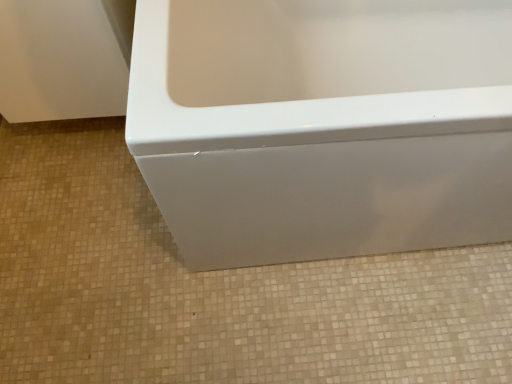
The width and height of the screenshot is (512, 384). What do you see at coordinates (215, 289) in the screenshot?
I see `white glossy bathtub at lower center` at bounding box center [215, 289].

Locate an element on the screen. The width and height of the screenshot is (512, 384). white glossy bathtub at lower center is located at coordinates (215, 289).

What is the approximate width of white glossy bathtub at center?

The width of white glossy bathtub at center is 29.92 inches.

This screenshot has height=384, width=512. Describe the element at coordinates (323, 126) in the screenshot. I see `white glossy bathtub at center` at that location.

The image size is (512, 384). Identify the location of white glossy bathtub at center. (323, 126).

At what (x,y) coordinates should I click in order to perform the action: click on white glossy bathtub at lower center. Please return your answer as a coordinate pair (x, y). The height and width of the screenshot is (384, 512). Looking at the image, I should click on (215, 289).

Considering the relative positions of white glossy bathtub at lower center and white glossy bathtub at center in the image provided, is white glossy bathtub at lower center to the right of white glossy bathtub at center from the viewer's perspective?

In fact, white glossy bathtub at lower center is to the left of white glossy bathtub at center.

Considering the relative positions of white glossy bathtub at lower center and white glossy bathtub at center in the image provided, is white glossy bathtub at lower center in front of white glossy bathtub at center?

That is False.

Between point (373, 352) and point (354, 130), which one is positioned in front?

Positioned in front is point (354, 130).

From the image's perspective, does white glossy bathtub at lower center appear higher than white glossy bathtub at center?

No, from the image's perspective, white glossy bathtub at lower center is not over white glossy bathtub at center.

From a real-world perspective, is white glossy bathtub at lower center physically located above or below white glossy bathtub at center?

white glossy bathtub at lower center is situated lower than white glossy bathtub at center in the real world.

Between white glossy bathtub at lower center and white glossy bathtub at center, which one has larger width?

white glossy bathtub at lower center.

Which of these two, white glossy bathtub at lower center or white glossy bathtub at center, stands shorter?

white glossy bathtub at lower center.

From the picture: Can you confirm if white glossy bathtub at lower center is bigger than white glossy bathtub at center?

Incorrect, white glossy bathtub at lower center is not larger than white glossy bathtub at center.

Is white glossy bathtub at lower center inside the boundaries of white glossy bathtub at center, or outside?

white glossy bathtub at lower center is located beyond the bounds of white glossy bathtub at center.

Is white glossy bathtub at lower center not near white glossy bathtub at center?

That's not correct — white glossy bathtub at lower center is a little close to white glossy bathtub at center.

Is white glossy bathtub at lower center turned away from white glossy bathtub at center?

white glossy bathtub at lower center is not turned away from white glossy bathtub at center.

Locate an element on the screen. ceramic tile on the left of white glossy bathtub at center is located at coordinates (215, 289).

Is white glossy bathtub at center to the left of white glossy bathtub at lower center from the viewer's perspective?

No, white glossy bathtub at center is not to the left of white glossy bathtub at lower center.

Which object is closer to the camera, white glossy bathtub at center or white glossy bathtub at lower center?

white glossy bathtub at center.

Which is further, (337, 71) or (365, 360)?

The point (337, 71) is behind.

Consider the image. From the image's perspective, between white glossy bathtub at center and white glossy bathtub at lower center, who is located below?

white glossy bathtub at lower center.

Consider the image. From a real-world perspective, does white glossy bathtub at center sit lower than white glossy bathtub at lower center?

Incorrect, from a real-world perspective, white glossy bathtub at center is higher than white glossy bathtub at lower center.

Which object is wider, white glossy bathtub at center or white glossy bathtub at lower center?

white glossy bathtub at lower center is wider.

From their relative heights in the image, would you say white glossy bathtub at center is taller or shorter than white glossy bathtub at lower center?

In the image, white glossy bathtub at center appears to be taller than white glossy bathtub at lower center.

Considering the sizes of objects white glossy bathtub at center and white glossy bathtub at lower center in the image provided, who is smaller, white glossy bathtub at center or white glossy bathtub at lower center?

white glossy bathtub at lower center.

Is white glossy bathtub at center completely or partially outside of white glossy bathtub at lower center?

Yes.

Are white glossy bathtub at center and white glossy bathtub at lower center located far from each other?

No.

Is white glossy bathtub at center facing towards white glossy bathtub at lower center?

No.

In the scene shown: How far apart are white glossy bathtub at center and white glossy bathtub at lower center?

The distance of white glossy bathtub at center from white glossy bathtub at lower center is 15.25 inches.

The image size is (512, 384). What are the coordinates of `ceramic tile that appears behind the white glossy bathtub at center` in the screenshot? It's located at pyautogui.click(x=215, y=289).

Identify the location of bathtub above the white glossy bathtub at lower center (from a real-world perspective). (323, 126).

Where is `bathtub to the right of white glossy bathtub at lower center`? The image size is (512, 384). bathtub to the right of white glossy bathtub at lower center is located at coordinates (323, 126).